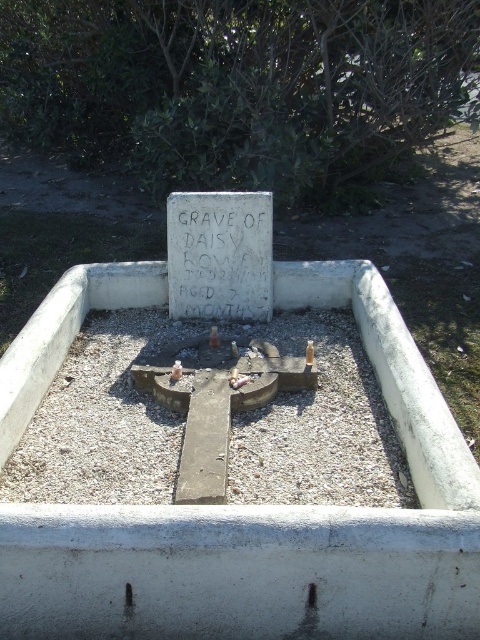
Does white concrete cross at center appear under white stone plaque at center?

Correct, white concrete cross at center is located below white stone plaque at center.

Does white concrete cross at center have a greater height compared to white stone plaque at center?

Yes, white concrete cross at center is taller than white stone plaque at center.

The height and width of the screenshot is (640, 480). Describe the element at coordinates (269, 529) in the screenshot. I see `white concrete cross at center` at that location.

Where is `white concrete cross at center`? white concrete cross at center is located at coordinates (269, 529).

Does white concrete cross at center have a greater height compared to gray gravel at center?

Indeed, white concrete cross at center has a greater height compared to gray gravel at center.

Does white concrete cross at center have a lesser height compared to gray gravel at center?

In fact, white concrete cross at center may be taller than gray gravel at center.

Is point (213, 579) positioned after point (81, 497)?

No, it is in front of (81, 497).

Locate an element on the screen. The height and width of the screenshot is (640, 480). white concrete cross at center is located at coordinates (269, 529).

Can you confirm if gray gravel at center is shorter than white stone plaque at center?

No, gray gravel at center is not shorter than white stone plaque at center.

Between gray gravel at center and white stone plaque at center, which one appears on the right side from the viewer's perspective?

white stone plaque at center

Who is more forward, (x=346, y=364) or (x=249, y=264)?

Point (x=346, y=364) is in front.

At what (x,y) coordinates should I click in order to perform the action: click on gray gravel at center. Please return your answer as a coordinate pair (x, y). Image resolution: width=480 pixels, height=640 pixels. Looking at the image, I should click on (101, 420).